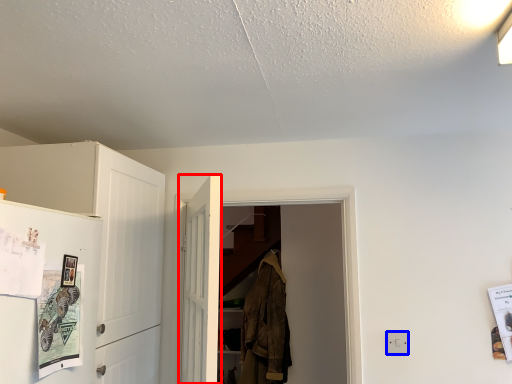
Question: Which of the following is the farthest to the observer, door (highlighted by a red box) or electric outlet (highlighted by a blue box)?

Choices:
 (A) door
 (B) electric outlet

Answer: (B)